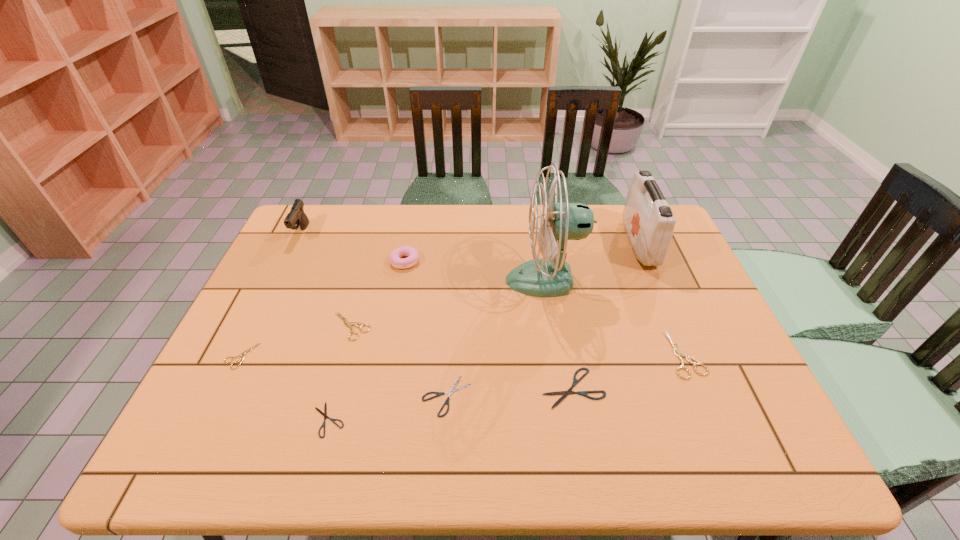
At what (x,y) coordinates should I click in order to perform the action: click on the sixth closest object to the eighth shortest object. Please return your answer as a coordinate pair (x, y). This screenshot has width=960, height=540. Looking at the image, I should click on (449, 392).

The height and width of the screenshot is (540, 960). In order to click on shears that is the nearest to the first-aid kit in this screenshot , I will do `click(679, 354)`.

This screenshot has height=540, width=960. I want to click on shears that is the closest one to the rightmost shears, so click(x=584, y=393).

Identify the location of the second closest beige shears relative to the second black shears from left to right. The height and width of the screenshot is (540, 960). (243, 354).

Choose which beige shears is the nearest neighbor to the leftmost beige shears. Please provide its 2D coordinates. Your answer should be formatted as a tuple, i.e. [(x, y)], where the tuple contains the x and y coordinates of a point satisfying the conditions above.

[(349, 324)]

Identify which black shears is the closest to the second biggest black shears. Please provide its 2D coordinates. Your answer should be formatted as a tuple, i.e. [(x, y)], where the tuple contains the x and y coordinates of a point satisfying the conditions above.

[(324, 414)]

At what (x,y) coordinates should I click in order to perform the action: click on black shears that is the closest to the fifth shortest shears. Please return your answer as a coordinate pair (x, y). This screenshot has width=960, height=540. Looking at the image, I should click on coord(324,414).

At what (x,y) coordinates should I click in order to perform the action: click on vacant space that satisfies the following two spatial constraints: 1. at the barrel of the seventh shortest object; 2. on the left side of the black pistol. Please return your answer as a coordinate pair (x, y). Image resolution: width=960 pixels, height=540 pixels. Looking at the image, I should click on (288, 261).

The width and height of the screenshot is (960, 540). I want to click on vacant point that satisfies the following two spatial constraints: 1. in front of the teal fan, directing airflow; 2. on the back side of the tallest shears, so click(x=557, y=354).

Locate an element on the screen. free location that satisfies the following two spatial constraints: 1. at the barrel of the pistol; 2. on the left side of the second tallest shears is located at coordinates (x=256, y=326).